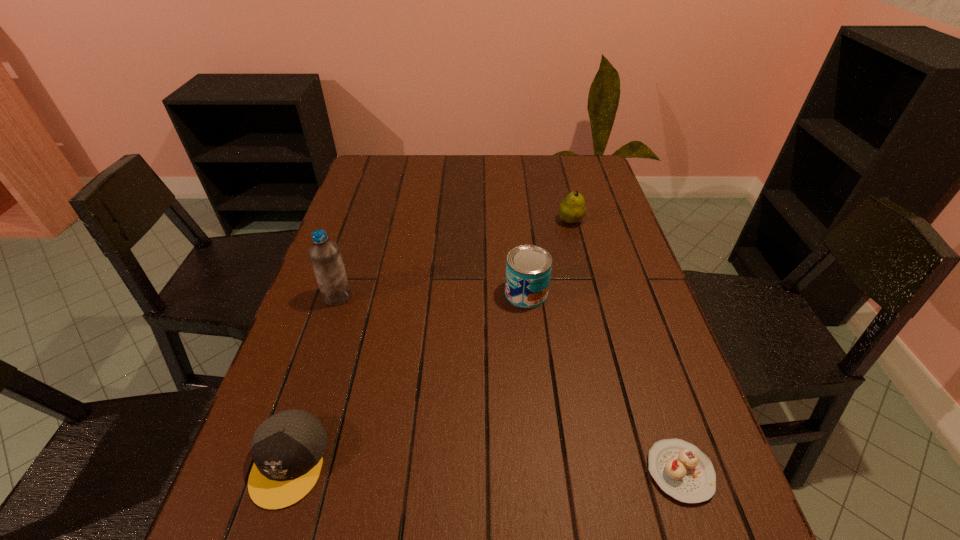
Locate an element on the screen. The width and height of the screenshot is (960, 540). water bottle is located at coordinates (324, 254).

This screenshot has width=960, height=540. Find the location of `pear`. pear is located at coordinates (572, 209).

Locate an element on the screen. can is located at coordinates (528, 268).

Locate an element on the screen. The image size is (960, 540). cap is located at coordinates (287, 448).

Find the location of a particular element. The image size is (960, 540). cupcake is located at coordinates (681, 470).

Locate an element on the screen. Image resolution: width=960 pixels, height=540 pixels. vacant region located on the back of the tallest object is located at coordinates (366, 212).

The height and width of the screenshot is (540, 960). I want to click on vacant position located 0.380m on the left of the farthest object, so click(x=435, y=221).

Identify the location of free location located on the left of the third object from left to right. The image size is (960, 540). (380, 293).

In order to click on vacant region located 0.230m on the back of the cupcake in this screenshot , I will do `click(638, 346)`.

This screenshot has height=540, width=960. In order to click on water bottle present at the left edge in this screenshot , I will do `click(324, 254)`.